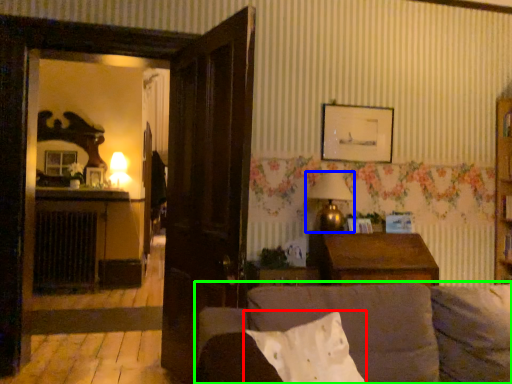
Question: Which object is positioned closest to pillow (highlighted by a red box)? Select from lamp (highlighted by a blue box) and studio couch (highlighted by a green box).

Choices:
 (A) lamp
 (B) studio couch

Answer: (B)